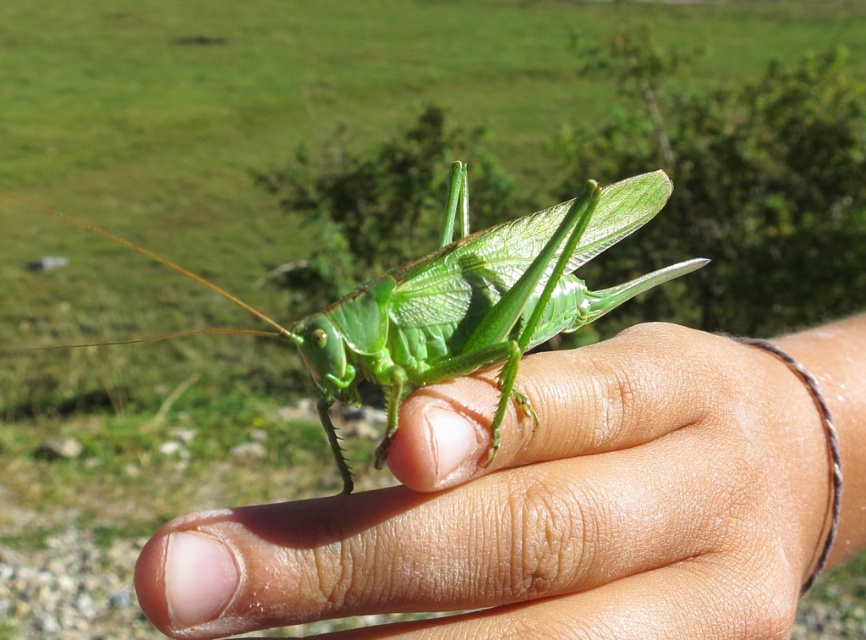
Between smooth skin hand at center and green matte grasshopper at center, which one appears on the right side from the viewer's perspective?

smooth skin hand at center is more to the right.

Find the location of a particular element. smooth skin hand at center is located at coordinates (541, 509).

What are the coordinates of `smooth skin hand at center` in the screenshot? It's located at (541, 509).